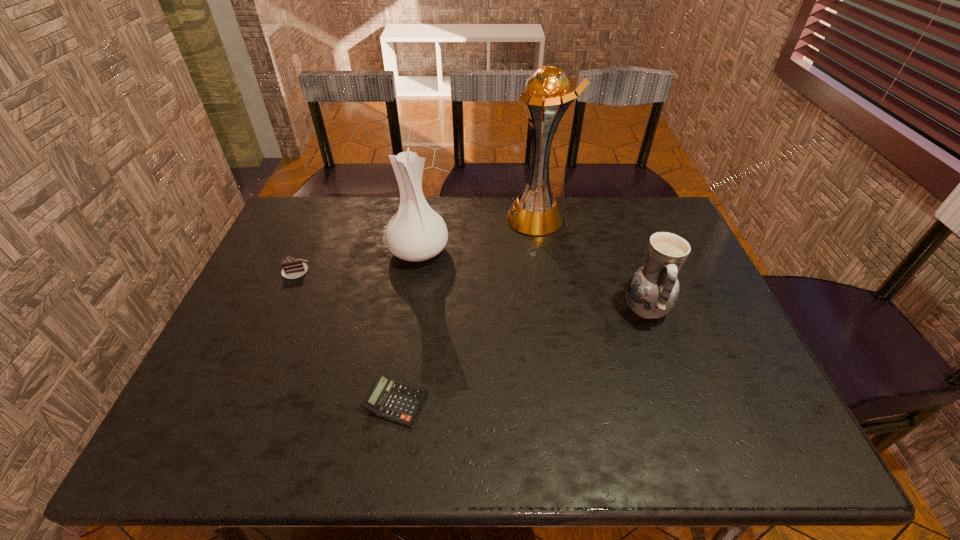
What are the coordinates of `object that is at the near edge` in the screenshot? It's located at (391, 399).

The width and height of the screenshot is (960, 540). What are the coordinates of `object that is at the left edge` in the screenshot? It's located at (293, 268).

At what (x,y) coordinates should I click in order to perform the action: click on object that is positioned at the right edge. Please return your answer as a coordinate pair (x, y). Looking at the image, I should click on (652, 291).

Locate an element on the screen. vacant space at the far edge of the desktop is located at coordinates (444, 206).

The width and height of the screenshot is (960, 540). Identify the location of vacant space at the near edge of the desktop. (350, 459).

What are the coordinates of `vacant area at the left edge of the desktop` in the screenshot? It's located at (297, 249).

The height and width of the screenshot is (540, 960). Identify the location of vacant space at the right edge of the desktop. pos(693,367).

The image size is (960, 540). In the image, there is a desktop. In order to click on vacant space at the far left corner in this screenshot , I will do `click(320, 238)`.

The width and height of the screenshot is (960, 540). I want to click on unoccupied area between the pottery and the nearest object, so click(520, 355).

You are a GUI agent. You are given a task and a screenshot of the screen. Output one action in this format:
    pyautogui.click(x=<x>, y=<y>)
    Task: Click on the empty location between the calculator and the pottery
    The width and height of the screenshot is (960, 540).
    Given the screenshot: What is the action you would take?
    pyautogui.click(x=520, y=355)